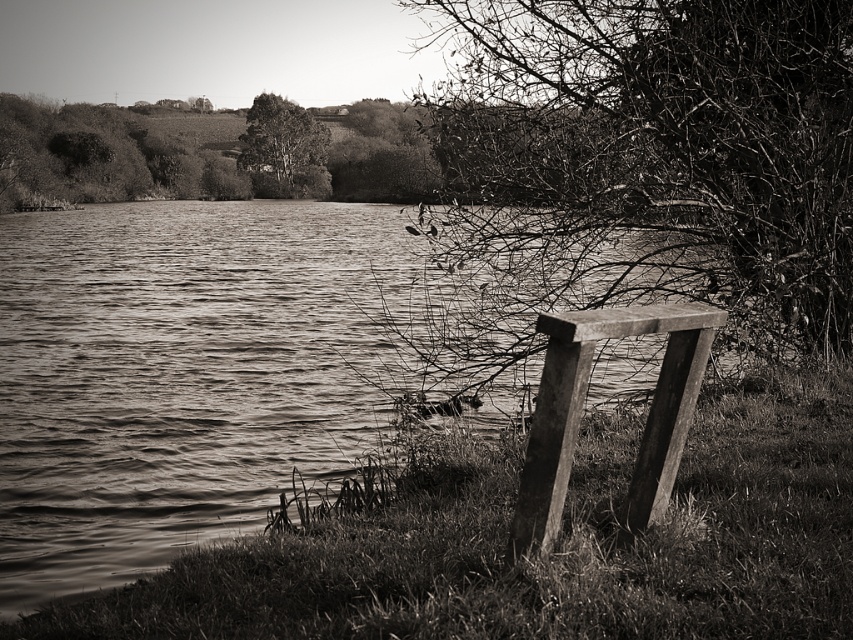
This screenshot has height=640, width=853. What do you see at coordinates (657, 156) in the screenshot?
I see `smooth bark tree at right` at bounding box center [657, 156].

Does smooth bark tree at right have a larger size compared to wooden plank bench at right?

Correct, smooth bark tree at right is larger in size than wooden plank bench at right.

Which is behind, point (647, 100) or point (550, 380)?

The point (647, 100) is more distant.

Locate an element on the screen. This screenshot has height=640, width=853. smooth bark tree at right is located at coordinates (657, 156).

Does smooth water at lower left have a smaller size compared to smooth bark tree at right?

No, smooth water at lower left is not smaller than smooth bark tree at right.

Does point (3, 484) come behind point (439, 140)?

No, it is not.

Is point (175, 513) closer to camera compared to point (728, 269)?

Yes.

At what (x,y) coordinates should I click in order to perform the action: click on smooth water at lower left. Please return your answer as a coordinate pair (x, y). Looking at the image, I should click on (184, 372).

This screenshot has width=853, height=640. What do you see at coordinates (582, 404) in the screenshot?
I see `wooden plank bench at right` at bounding box center [582, 404].

Which is below, wooden plank bench at right or smooth bark tree at upper center?

wooden plank bench at right is below.

Where is `wooden plank bench at right`? Image resolution: width=853 pixels, height=640 pixels. wooden plank bench at right is located at coordinates (582, 404).